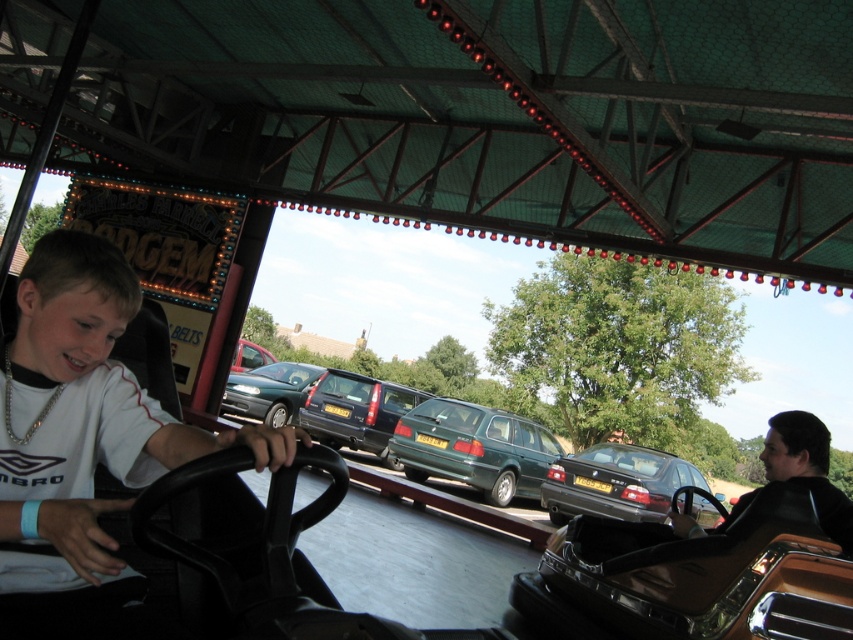
You are planning to park your car in the fairground parking lot. You have a shiny black sedan at center and a shiny black car at right. Which one would require more space to park?

The shiny black sedan at center requires more space to park because it has a larger size compared to the shiny black car at right.

You are observing bumper cars at a fairground under a green canopy. There are two cars present, the metallic blue car at center and the metallic silver car at center. From your perspective, which car is positioned to the right of the other?

The metallic blue car at center is to the right of the metallic silver car at center.